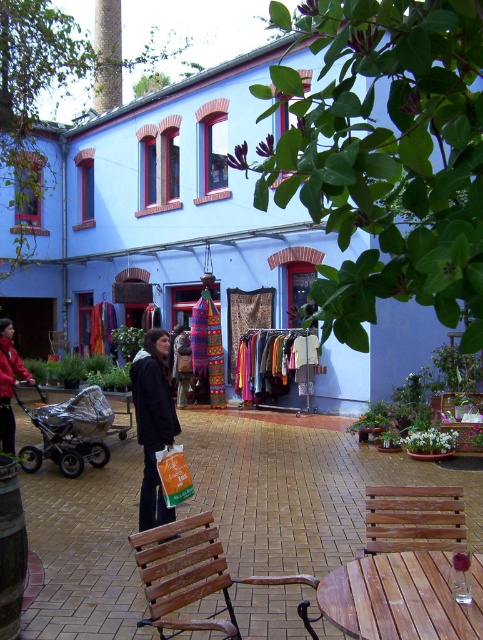
Which is in front, point (418, 528) or point (67, 404)?

Point (418, 528)

Does point (397, 538) lie in front of point (71, 432)?

Yes, point (397, 538) is in front of point (71, 432).

What do you see at coordinates (413, 518) in the screenshot?
I see `wooden bench at lower center` at bounding box center [413, 518].

Identify the location of wooden bench at lower center. Image resolution: width=483 pixels, height=640 pixels. (413, 518).

Is wooden bench at lower center positioned in front of black fabric bag at center?

Yes, wooden bench at lower center is in front of black fabric bag at center.

Is wooden bench at lower center shorter than black fabric bag at center?

Yes, wooden bench at lower center is shorter than black fabric bag at center.

Is point (440, 524) positioned after point (145, 500)?

That is False.

In order to click on wooden bench at lower center in this screenshot , I will do `click(413, 518)`.

Is point (211, 525) positioned before point (13, 364)?

Yes, point (211, 525) is in front of point (13, 364).

Which is behind, point (168, 570) or point (13, 387)?

The point (13, 387) is more distant.

What do you see at coordinates (190, 573) in the screenshot? I see `wooden bench at center` at bounding box center [190, 573].

Where is `wooden bench at center`? The width and height of the screenshot is (483, 640). wooden bench at center is located at coordinates (190, 573).